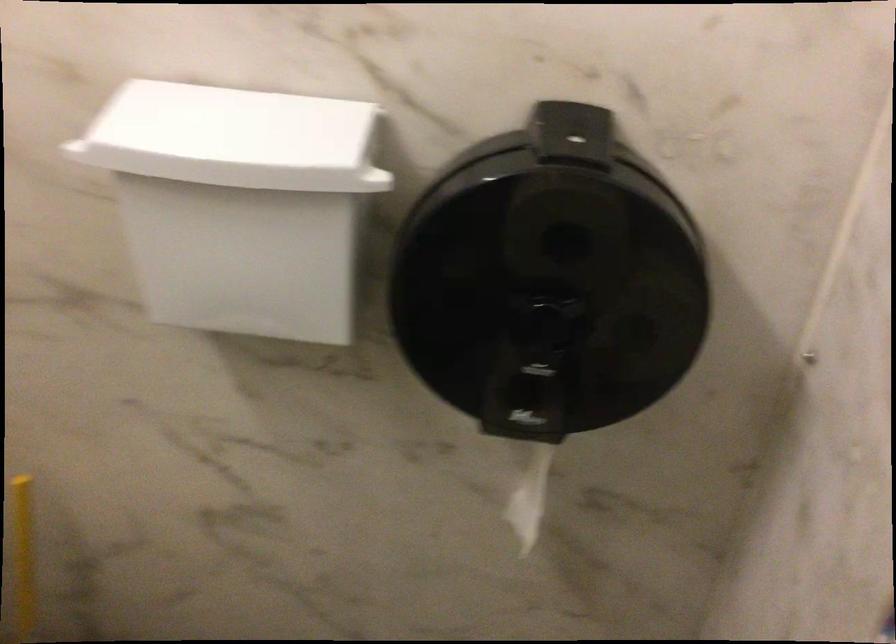
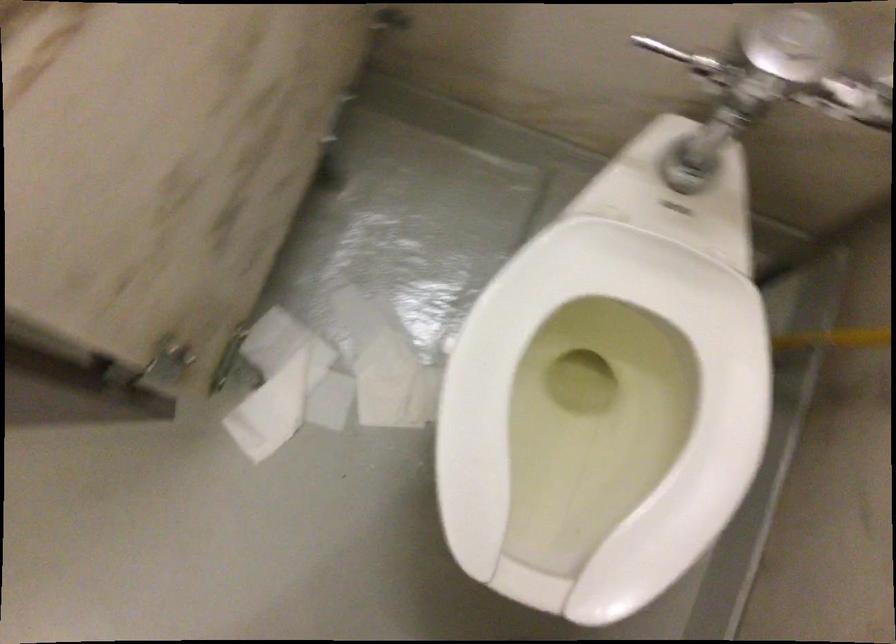
Based on the continuous images, in which direction is the camera rotating?

The rotation direction of the camera is left-down.